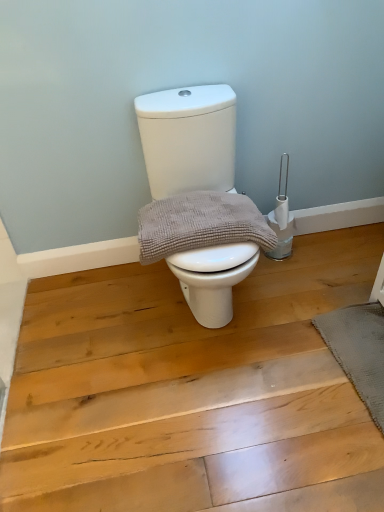
Question: Considering the relative positions of gray textured towel at center and gray textured bath mat at lower right in the image provided, is gray textured towel at center to the right of gray textured bath mat at lower right from the viewer's perspective?

Choices:
 (A) yes
 (B) no

Answer: (B)

Question: Does gray textured towel at center have a greater height compared to gray textured bath mat at lower right?

Choices:
 (A) no
 (B) yes

Answer: (B)

Question: Does gray textured towel at center have a smaller size compared to gray textured bath mat at lower right?

Choices:
 (A) yes
 (B) no

Answer: (B)

Question: Can you confirm if gray textured towel at center is thinner than gray textured bath mat at lower right?

Choices:
 (A) yes
 (B) no

Answer: (B)

Question: Considering the relative sizes of gray textured towel at center and gray textured bath mat at lower right in the image provided, is gray textured towel at center shorter than gray textured bath mat at lower right?

Choices:
 (A) no
 (B) yes

Answer: (A)

Question: Is gray textured bath mat at lower right to the left or to the right of white glossy toilet at center in the image?

Choices:
 (A) left
 (B) right

Answer: (B)

Question: In terms of height, does gray textured bath mat at lower right look taller or shorter compared to white glossy toilet at center?

Choices:
 (A) tall
 (B) short

Answer: (B)

Question: Does point (359, 352) appear closer or farther from the camera than point (172, 119)?

Choices:
 (A) farther
 (B) closer

Answer: (A)

Question: Would you say gray textured bath mat at lower right is inside or outside white glossy toilet at center?

Choices:
 (A) inside
 (B) outside

Answer: (B)

Question: From the image's perspective, is white glossy toilet at center located above or below gray textured bath mat at lower right?

Choices:
 (A) below
 (B) above

Answer: (B)

Question: From a real-world perspective, is white glossy toilet at center positioned above or below gray textured bath mat at lower right?

Choices:
 (A) above
 (B) below

Answer: (A)

Question: Is point [x=188, y=287] positioned closer to the camera than point [x=354, y=343]?

Choices:
 (A) farther
 (B) closer

Answer: (B)

Question: Is white glossy toilet at center to the left or to the right of gray textured bath mat at lower right in the image?

Choices:
 (A) right
 (B) left

Answer: (B)

Question: Is gray textured towel at center in front of or behind white glossy toilet at center in the image?

Choices:
 (A) front
 (B) behind

Answer: (B)

Question: Is gray textured towel at center taller or shorter than white glossy toilet at center?

Choices:
 (A) tall
 (B) short

Answer: (B)